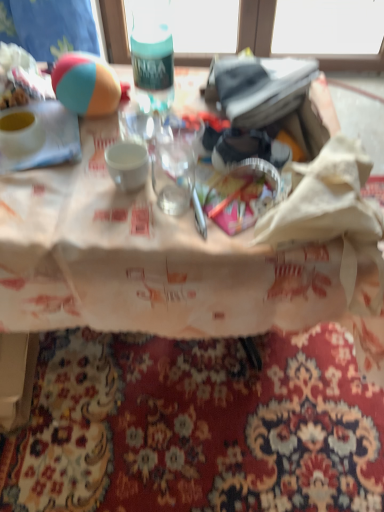
Question: In terms of height, does translucent plastic cup at center look taller or shorter compared to teal matte bottle at upper center?

Choices:
 (A) short
 (B) tall

Answer: (A)

Question: Considering the relative positions of translucent plastic cup at center and teal matte bottle at upper center in the image provided, is translucent plastic cup at center to the left or to the right of teal matte bottle at upper center?

Choices:
 (A) right
 (B) left

Answer: (A)

Question: Which object is the farthest from the translucent plastic cup at center?

Choices:
 (A) matte white bowl at upper left
 (B) teal matte bottle at upper center
 (C) tri-color rubber ball at upper left

Answer: (A)

Question: Estimate the real-world distances between objects in this image. Which object is farther from the matte white bowl at upper left?

Choices:
 (A) tri-color rubber ball at upper left
 (B) teal matte bottle at upper center
 (C) translucent plastic cup at center

Answer: (C)